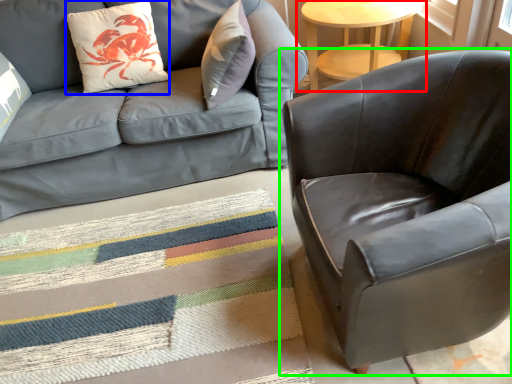
Question: Estimate the real-world distances between objects in this image. Which object is closer to table (highlighted by a red box), throw pillow (highlighted by a blue box) or chair (highlighted by a green box)?

Choices:
 (A) throw pillow
 (B) chair

Answer: (A)